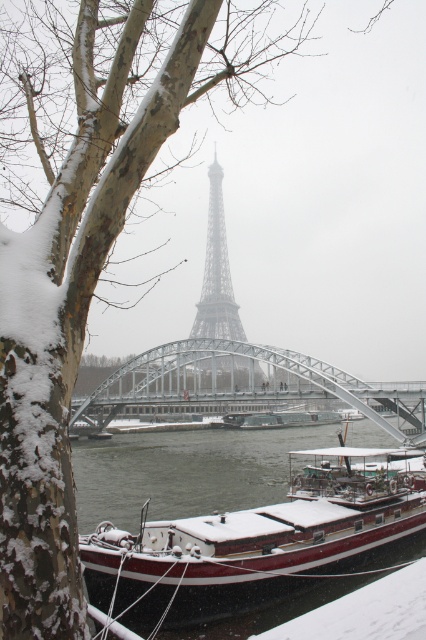
Which of these two, snow-covered wooden boat at lower center or metallic structure at center, stands shorter?

Standing shorter between the two is snow-covered wooden boat at lower center.

Between point (147, 576) and point (209, 307), which one is positioned in front?

Positioned in front is point (147, 576).

This screenshot has width=426, height=640. In order to click on snow-covered wooden boat at lower center in this screenshot , I will do `click(241, 556)`.

Who is shorter, metallic gray bridge at center or metallic structure at center?

metallic gray bridge at center

Can you confirm if metallic gray bridge at center is bigger than metallic structure at center?

No, metallic gray bridge at center is not bigger than metallic structure at center.

The height and width of the screenshot is (640, 426). I want to click on metallic gray bridge at center, so click(x=247, y=384).

Locate an element on the screen. The height and width of the screenshot is (640, 426). metallic gray bridge at center is located at coordinates point(247,384).

Is point (235, 547) more distant than point (357, 387)?

That is False.

Which is above, snow-covered wooden boat at lower center or metallic gray bridge at center?

metallic gray bridge at center

The height and width of the screenshot is (640, 426). Describe the element at coordinates (241, 556) in the screenshot. I see `snow-covered wooden boat at lower center` at that location.

Find the location of a particular element. This screenshot has width=426, height=640. snow-covered wooden boat at lower center is located at coordinates (241, 556).